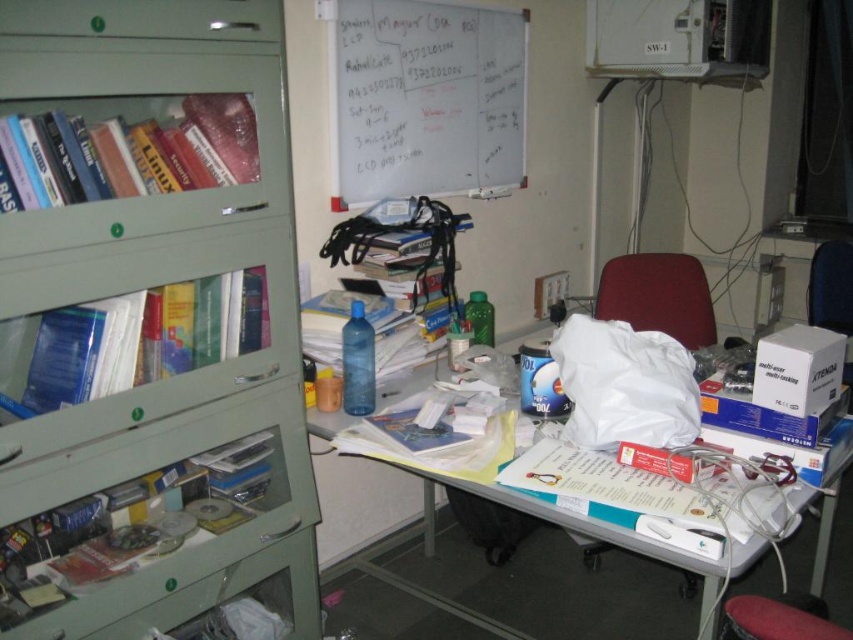
Does hardcover books at left have a smaller size compared to white paper at center?

No, hardcover books at left is not smaller than white paper at center.

Is point (27, 166) in front of point (523, 481)?

Yes.

Image resolution: width=853 pixels, height=640 pixels. Describe the element at coordinates (125, 147) in the screenshot. I see `hardcover books at left` at that location.

Locate an element on the screen. hardcover books at left is located at coordinates (125, 147).

Between white paper at center and velvet-like maroon chair at center, which one appears on the right side from the viewer's perspective?

Positioned to the right is velvet-like maroon chair at center.

Does white paper at center appear under velvet-like maroon chair at center?

Yes, white paper at center is below velvet-like maroon chair at center.

Where is `white paper at center`? This screenshot has width=853, height=640. white paper at center is located at coordinates (604, 483).

Is matte hardcover book at left shorter than white paper at center?

No, matte hardcover book at left is not shorter than white paper at center.

What do you see at coordinates (141, 339) in the screenshot?
I see `matte hardcover book at left` at bounding box center [141, 339].

The image size is (853, 640). I want to click on matte hardcover book at left, so click(x=141, y=339).